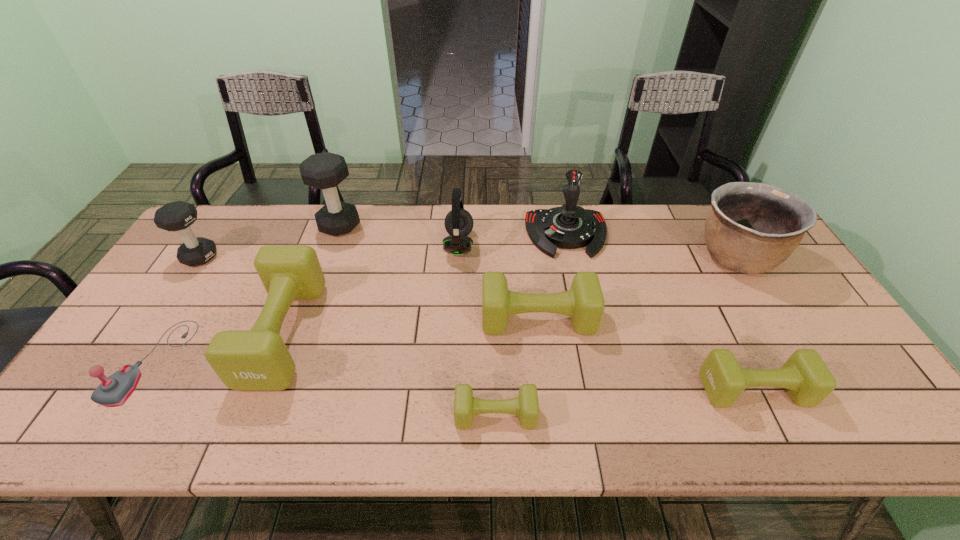
Identify the location of vacant space that satisfies the following two spatial constraints: 1. on the ear cups of the headset; 2. on the front side of the gray joystick. The image size is (960, 540). (453, 361).

This screenshot has height=540, width=960. In order to click on vacant space that satisfies the following two spatial constraints: 1. on the front side of the rightmost dumbbell; 2. on the left side of the fifth shortest object in this screenshot , I will do `click(260, 390)`.

Identify the location of free space that satisfies the following two spatial constraints: 1. on the ear cups of the black headset; 2. on the right side of the shortest object. Image resolution: width=960 pixels, height=540 pixels. (450, 415).